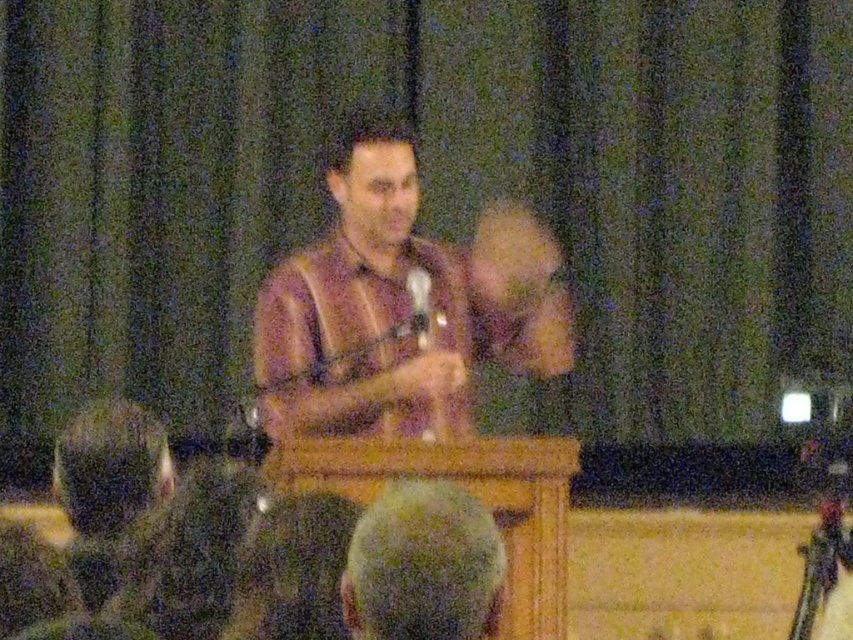
Question: Which of the following is the closest to the observer?

Choices:
 (A) smooth brown hair at center
 (B) translucent plastic microphone at center
 (C) dark green fabric at lower center
 (D) matte brown shirt at center

Answer: (A)

Question: Which point is closer to the camera?

Choices:
 (A) dark green fabric at lower center
 (B) smooth brown hair at center
 (C) translucent plastic microphone at center

Answer: (B)

Question: Is matte brown shirt at center below dark green fabric at lower center?

Choices:
 (A) no
 (B) yes

Answer: (A)

Question: Is smooth brown hair at center thinner than translucent plastic microphone at center?

Choices:
 (A) yes
 (B) no

Answer: (B)

Question: Which of the following is the farthest from the observer?

Choices:
 (A) smooth brown hair at center
 (B) dark green fabric at lower center
 (C) matte brown shirt at center

Answer: (C)

Question: From the image, what is the correct spatial relationship of smooth brown hair at center in relation to dark green fabric at lower center?

Choices:
 (A) below
 (B) above

Answer: (A)